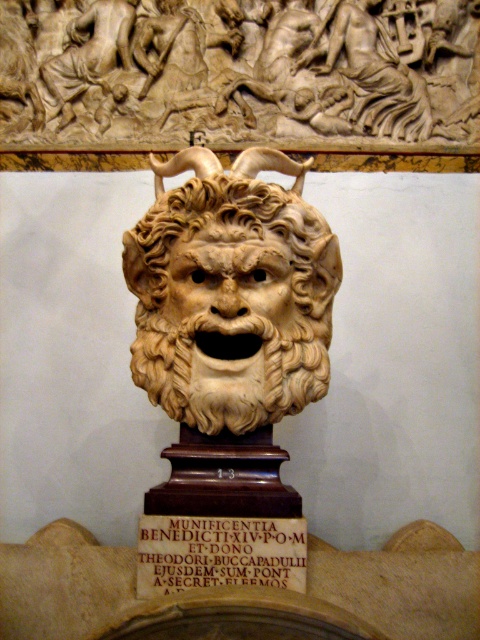
You are an art conservator assessing the placement of a new sculpture in a gallery. The beige marble lion at center is positioned at point (230,292). If the gallery requires that all sculptures must be placed within the central 50x50 cm area, which has coordinates ranging from 0.4 to 0.6 on both axes, will the beige marble lion at center meet this requirement?

The beige marble lion at center is positioned at point (230,292), which falls within the central 50x50 cm area specified by the gallery as it lies between 0.4 and 0.6 on both axes. Therefore, the sculpture meets the placement requirement.

You are an art restorer examining the classical sculpture of a head. You notice a specific point marked at coordinates point (230, 310). What is the significance of this point on the sculpture?

The point 0.487, 081 marks the carved ivory lion head at center.

You are an art conservator examining the classical sculpture. You notice the beige marble lion at center and the carved stone plaque at center. Based on their positions, which object is closer to the right edge of the sculpture?

The beige marble lion at center is to the right of the carved stone plaque at center, so it is closer to the right edge of the sculpture.